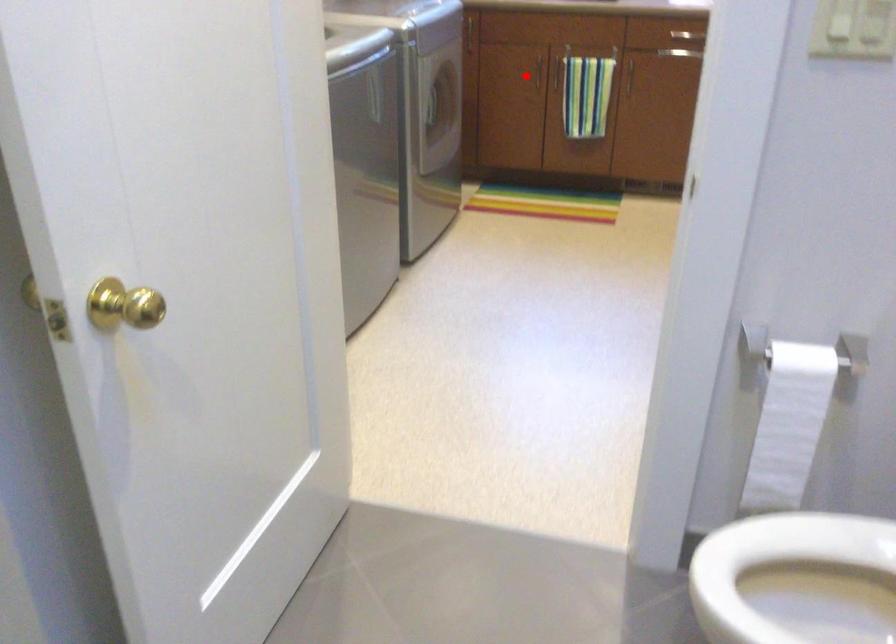
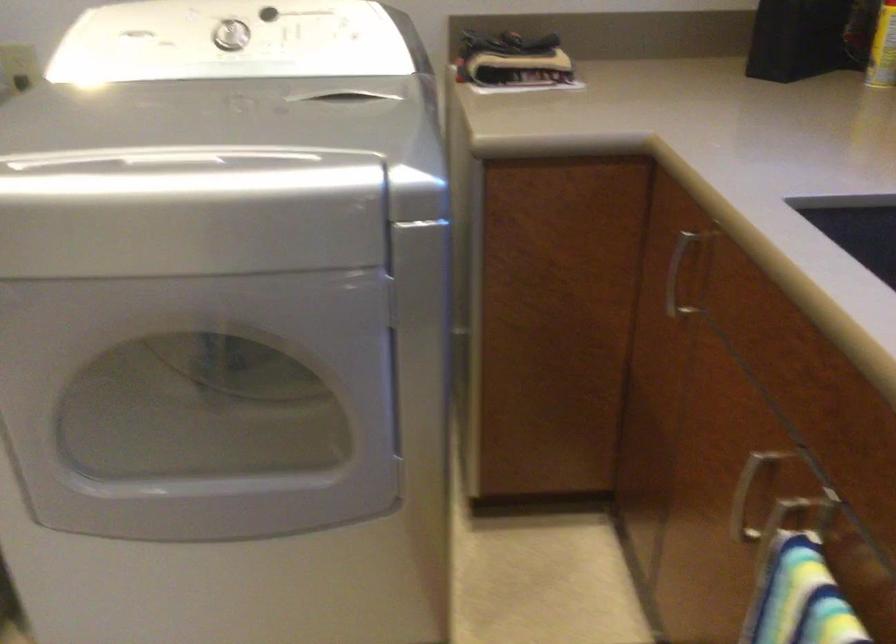
Where in the second image is the point corresponding to the highlighted location from the first image?

(745, 497)